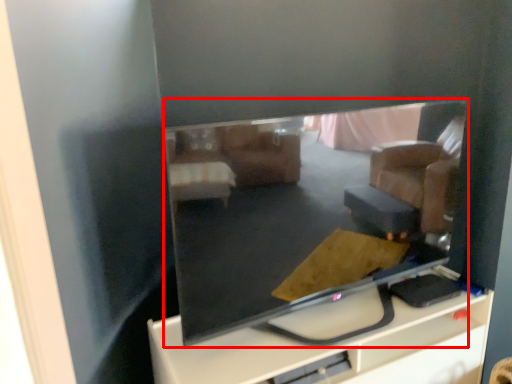
Question: Considering the relative positions of television (annotated by the red box) and furniture in the image provided, where is television (annotated by the red box) located with respect to the staircase?

Choices:
 (A) left
 (B) right

Answer: (A)